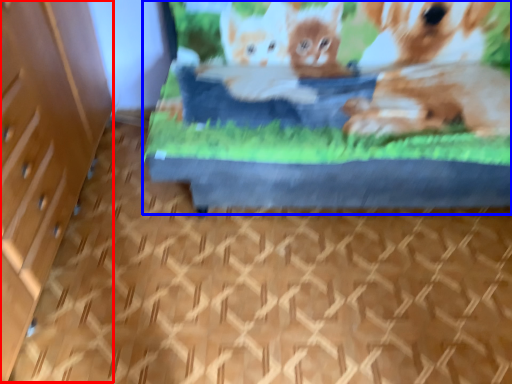
Question: Among these objects, which one is farthest to the camera, file cabinet (highlighted by a red box) or bed (highlighted by a blue box)?

Choices:
 (A) file cabinet
 (B) bed

Answer: (B)